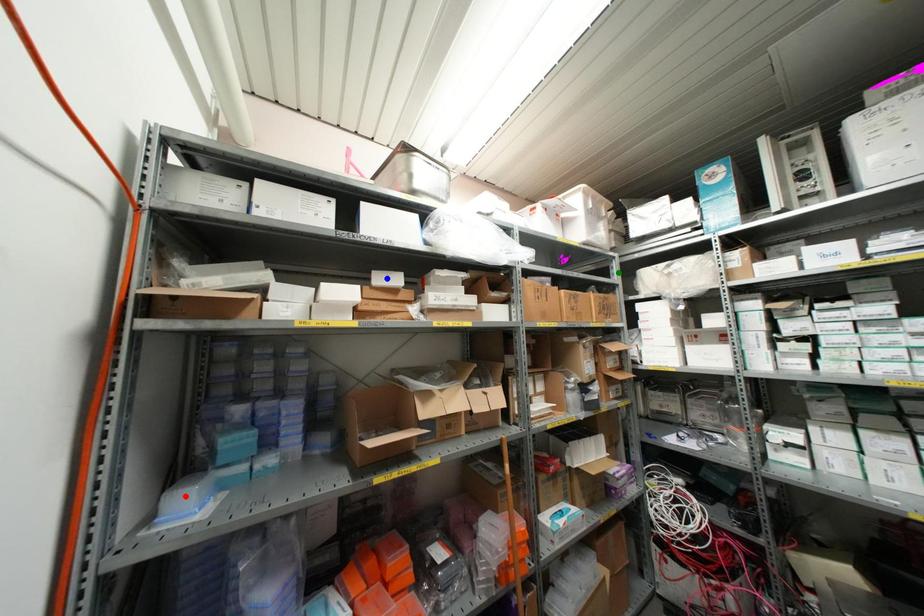
From the picture: Order these from nearest to farthest:
- red point
- blue point
- green point

red point → blue point → green point